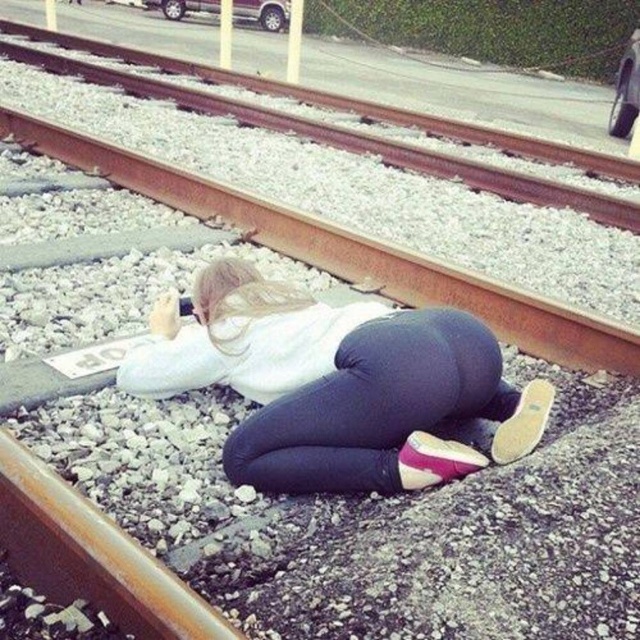
You are a pedestrian trying to cross the railway tracks safely. You see the white matte shirt at center and the rusty metal train track at center. Which object is closer to you, and how does this affect your path?

The white matte shirt at center is closer to the viewer than the rusty metal train track at center. This means the shirt is in your immediate vicinity, so you should step around it to reach the tracks safely.